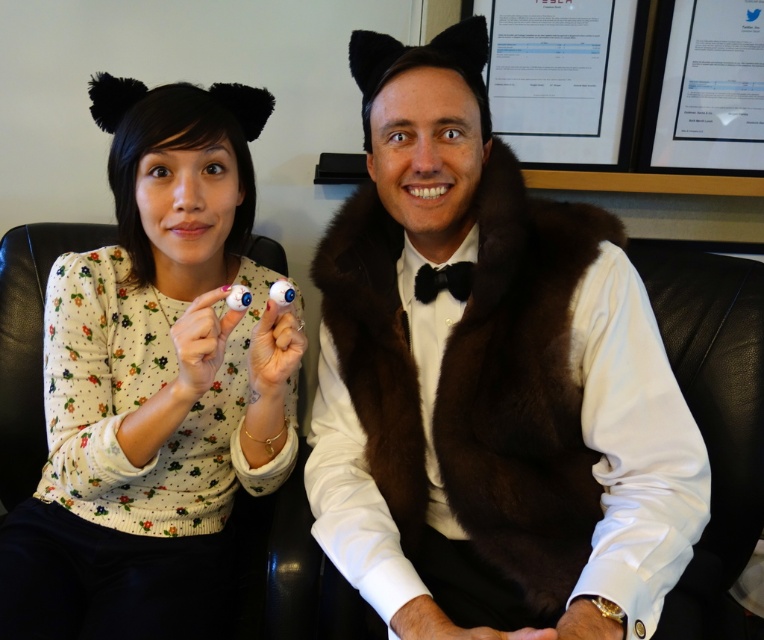
You are standing in front of a couch with two people sitting on it. You need to place a small decorative item exactly at the point marked as point (507, 588). Considering the people on the couch, will this placement be visible to someone standing directly in front of the couch?

The distance of point (507, 588) from viewer is 37.09 inches. Since this point is at a moderate distance from the viewer, the placement would likely be visible to someone standing directly in front of the couch, provided there are no obstructions from the people sitting there.

You are a tailor measuring the distance between two clothing items in the image. The brown fur vest at center and the white floral sweater at left are part of a costume design. Can you confirm if the distance between them is sufficient to allow a 10.5 inch wide decorative ribbon to be placed between them without overlapping?

The brown fur vest at center and the white floral sweater at left are 10.91 inches apart, so yes, the 10.5 inch wide decorative ribbon can be placed between them without overlapping since the space is slightly larger than the ribbon.

You are a tailor measuring the width of clothing items in the image. You need to determine which item is wider between the brown fur vest at center and the black satin bow tie at center. Can you tell me which one is wider?

The brown fur vest at center is wider than the black satin bow tie at center according to the description.